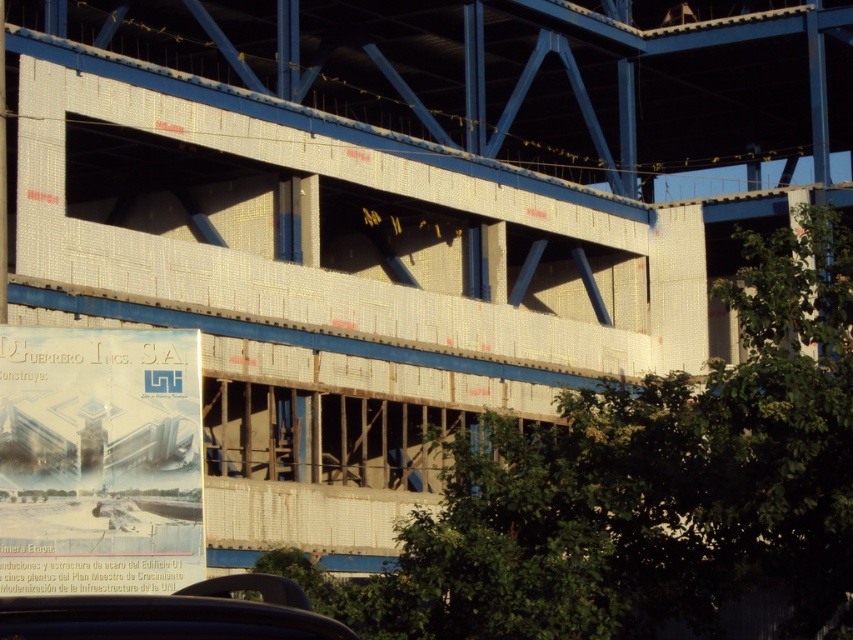
You are a delivery person who needs to park your car near the white paper poster at center. The parking spot must be next to the poster. Can the black matte car at lower center currently occupying the spot be moved to allow your car to park there?

The white paper poster at center is smaller than the black matte car at lower center, so the car is larger. Since the parking spot is next to the poster, the black matte car at lower center may be blocking it. If the car is moved, your car can park there, but the description does not specify if the spot is available or if moving the car is possible.

You are a delivery driver approaching the building and need to park your car. You see the white paper poster at center and the black matte car at lower center. Which object is closer to you as you approach the building?

The white paper poster at center is closer to you than the black matte car at lower center because it is further to the viewer.